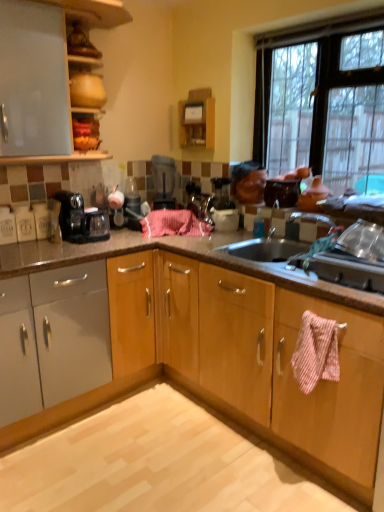
Where is `vacant space underneath metallic silver sink at right (from a real-world perspective)`? This screenshot has width=384, height=512. vacant space underneath metallic silver sink at right (from a real-world perspective) is located at coordinates (358, 256).